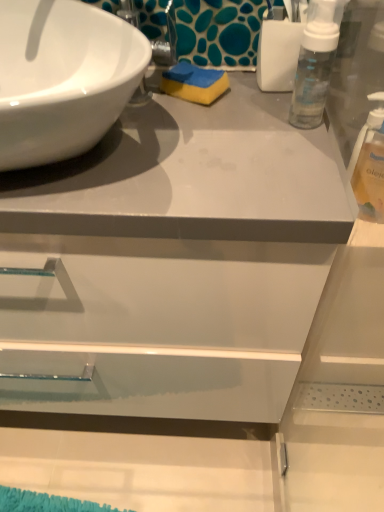
What is the approximate width of white glossy sink at upper left?

It is 15.78 inches.

Based on the photo, measure the distance between white glossy sink at upper left and camera.

white glossy sink at upper left and camera are 16.45 inches apart.

Find the location of `clear plastic bottle at right`. clear plastic bottle at right is located at coordinates (369, 167).

Where is `blue/yellow sponge at center`? blue/yellow sponge at center is located at coordinates (194, 83).

From the image's perspective, which one is positioned higher, blue/yellow sponge at center or clear plastic bottle at right?

blue/yellow sponge at center appears higher in the image.

The height and width of the screenshot is (512, 384). I want to click on soap on the left side of clear plastic bottle at right, so click(x=194, y=83).

In the scene shown: From a real-world perspective, is blue/yellow sponge at center located beneath clear plastic bottle at right?

No, from a real-world perspective, blue/yellow sponge at center is not beneath clear plastic bottle at right.

Which of these two, blue/yellow sponge at center or clear plastic bottle at right, is thinner?

clear plastic bottle at right.

Which is behind, white glossy sink at upper left or blue/yellow sponge at center?

blue/yellow sponge at center.

Which of these two, white glossy sink at upper left or blue/yellow sponge at center, is wider?

Wider between the two is white glossy sink at upper left.

From the image's perspective, which one is positioned higher, white glossy sink at upper left or blue/yellow sponge at center?

blue/yellow sponge at center, from the image's perspective.

How many degrees apart are the facing directions of white glossy sink at upper left and blue/yellow sponge at center?

The angle between the facing direction of white glossy sink at upper left and the facing direction of blue/yellow sponge at center is 35 degrees.

The image size is (384, 512). I want to click on soap above the clear plastic bottle at right (from the image's perspective), so click(194, 83).

Is clear plastic bottle at right oriented away from blue/yellow sponge at center?

That's not correct — clear plastic bottle at right is not looking away from blue/yellow sponge at center.

Which of these two, clear plastic bottle at right or blue/yellow sponge at center, is smaller?

Smaller between the two is blue/yellow sponge at center.

Is clear plastic bottle at right at the left side of blue/yellow sponge at center?

No.

From the image's perspective, is white glossy sink at upper left on top of clear plastic bottle at right?

Yes, from the image's perspective, white glossy sink at upper left is over clear plastic bottle at right.

The height and width of the screenshot is (512, 384). I want to click on sink above the clear plastic bottle at right (from a real-world perspective), so click(62, 78).

Can you confirm if white glossy sink at upper left is wider than clear plastic bottle at right?

Yes.

From the picture: Is white glossy sink at upper left at the back of blue/yellow sponge at center?

No, blue/yellow sponge at center is not facing the opposite direction of white glossy sink at upper left.

Does blue/yellow sponge at center have a smaller size compared to white glossy sink at upper left?

Yes, blue/yellow sponge at center is smaller than white glossy sink at upper left.

Which of these two, blue/yellow sponge at center or white glossy sink at upper left, is wider?

white glossy sink at upper left is wider.

Is clear plastic bottle at right not close to white glossy sink at upper left?

No, clear plastic bottle at right is not far from white glossy sink at upper left.

From their relative heights in the image, would you say clear plastic bottle at right is taller or shorter than white glossy sink at upper left?

Clearly, clear plastic bottle at right is taller compared to white glossy sink at upper left.

Can we say clear plastic bottle at right lies outside white glossy sink at upper left?

Yes, clear plastic bottle at right is located beyond the bounds of white glossy sink at upper left.

Is clear plastic bottle at right oriented towards white glossy sink at upper left?

No, clear plastic bottle at right is not turned towards white glossy sink at upper left.

Locate an element on the screen. The image size is (384, 512). cleaning product below the blue/yellow sponge at center (from the image's perspective) is located at coordinates (369, 167).

Where is `soap located on the right of white glossy sink at upper left`? soap located on the right of white glossy sink at upper left is located at coordinates (194, 83).

Estimate the real-world distances between objects in this image. Which object is closer to white glossy sink at upper left, clear plastic bottle at right or blue/yellow sponge at center?

The object closer to white glossy sink at upper left is blue/yellow sponge at center.

Looking at the image, which one is located further to clear plastic bottle at right, blue/yellow sponge at center or white glossy sink at upper left?

white glossy sink at upper left is further to clear plastic bottle at right.

From the image, which object appears to be farther from clear plastic bottle at right, white glossy sink at upper left or blue/yellow sponge at center?

white glossy sink at upper left lies further to clear plastic bottle at right than the other object.

Based on their spatial positions, is white glossy sink at upper left or clear plastic bottle at right further from blue/yellow sponge at center?

clear plastic bottle at right is further to blue/yellow sponge at center.

Estimate the real-world distances between objects in this image. Which object is closer to white glossy sink at upper left, blue/yellow sponge at center or clear plastic bottle at right?

The object closer to white glossy sink at upper left is blue/yellow sponge at center.

Considering their positions, is clear plastic bottle at right positioned further to blue/yellow sponge at center than white glossy sink at upper left?

The object further to blue/yellow sponge at center is clear plastic bottle at right.

Where is `soap between white glossy sink at upper left and clear plastic bottle at right in the horizontal direction`? soap between white glossy sink at upper left and clear plastic bottle at right in the horizontal direction is located at coordinates (194, 83).